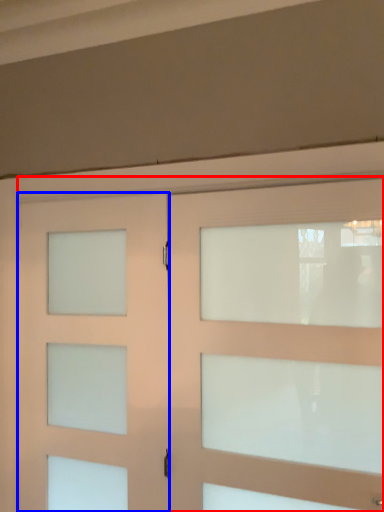
Question: Which object is further to the camera taking this photo, door (highlighted by a red box) or door (highlighted by a blue box)?

Choices:
 (A) door
 (B) door

Answer: (B)